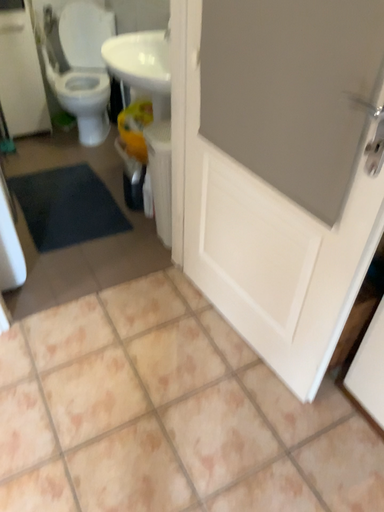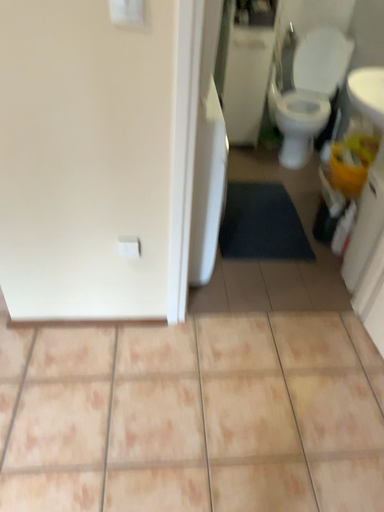
Question: How did the camera likely rotate when shooting the video?

Choices:
 (A) rotated left
 (B) rotated right

Answer: (A)